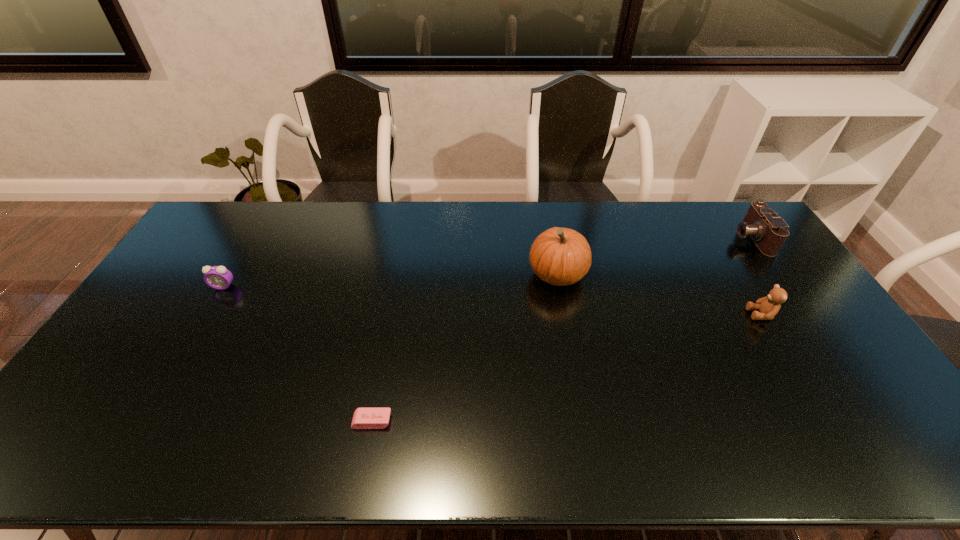
Identify the location of vacant region located on the stem of the pumpkin. (479, 275).

The width and height of the screenshot is (960, 540). I want to click on vacant region located on the stem of the pumpkin, so click(475, 275).

At what (x,y) coordinates should I click in order to perform the action: click on vacant area located 0.280m on the front-facing side of the rightmost object. Please return your answer as a coordinate pair (x, y). Image resolution: width=960 pixels, height=540 pixels. Looking at the image, I should click on (656, 238).

The height and width of the screenshot is (540, 960). Identify the location of free space located 0.120m on the front-facing side of the rightmost object. (701, 238).

The width and height of the screenshot is (960, 540). Find the location of `vacant space situated 0.260m on the front-facing side of the rightmost object`. vacant space situated 0.260m on the front-facing side of the rightmost object is located at coordinates (661, 238).

The height and width of the screenshot is (540, 960). Find the location of `vacant space situated 0.310m on the front-facing side of the teddy bear`. vacant space situated 0.310m on the front-facing side of the teddy bear is located at coordinates (645, 314).

Locate an element on the screen. vacant region located 0.380m on the front-facing side of the teddy bear is located at coordinates tap(621, 314).

The height and width of the screenshot is (540, 960). Identify the location of free location located 0.210m on the front-facing side of the teddy bear. (678, 314).

I want to click on free space located on the face of the alarm clock, so click(x=158, y=397).

You are a GUI agent. You are given a task and a screenshot of the screen. Output one action in this format:
    pyautogui.click(x=<x>, y=<y>)
    Task: Click on the vacant space located on the back of the nearest object
    
    Given the screenshot: What is the action you would take?
    pyautogui.click(x=396, y=299)